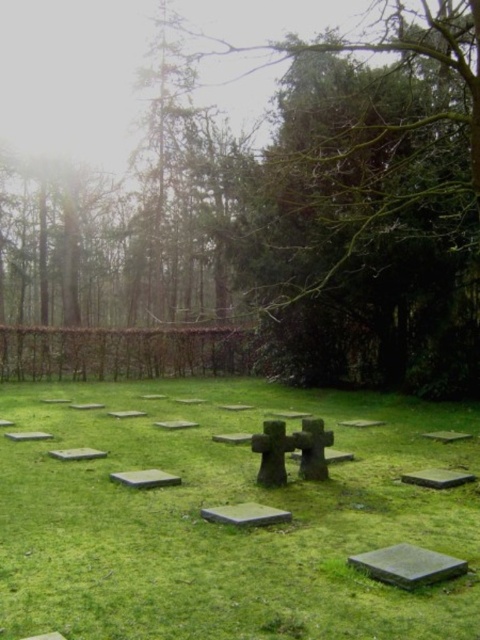
In the scene shown: Does smooth gray stone at lower right lie behind gray concrete gravestone at lower right?

No.

Can you confirm if smooth gray stone at lower right is positioned above gray concrete gravestone at lower right?

Indeed, smooth gray stone at lower right is positioned over gray concrete gravestone at lower right.

Is point (406, 545) less distant than point (447, 433)?

That is True.

Where is `smooth gray stone at lower right`? smooth gray stone at lower right is located at coordinates (408, 564).

Based on the photo, is green stone at center taller than gray concrete gravestone at center?

No.

Between green stone at center and gray concrete gravestone at center, which one has less height?

green stone at center is shorter.

What do you see at coordinates (245, 515) in the screenshot? I see `green stone at center` at bounding box center [245, 515].

Where is `green stone at center`? green stone at center is located at coordinates (245, 515).

Who is shorter, smooth gray stone at lower right or gray stone at center?

gray stone at center is shorter.

Can you confirm if smooth gray stone at lower right is taller than gray stone at center?

Correct, smooth gray stone at lower right is much taller as gray stone at center.

Who is more distant from viewer, (385,579) or (188,420)?

The point (188,420) is behind.

This screenshot has width=480, height=640. What are the coordinates of `smooth gray stone at lower right` in the screenshot? It's located at (408, 564).